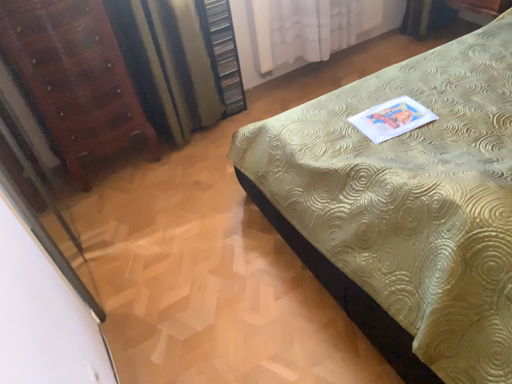
Find the location of a particular element. The image size is (512, 384). free space in front of mahogany wood dresser at left is located at coordinates 123,205.